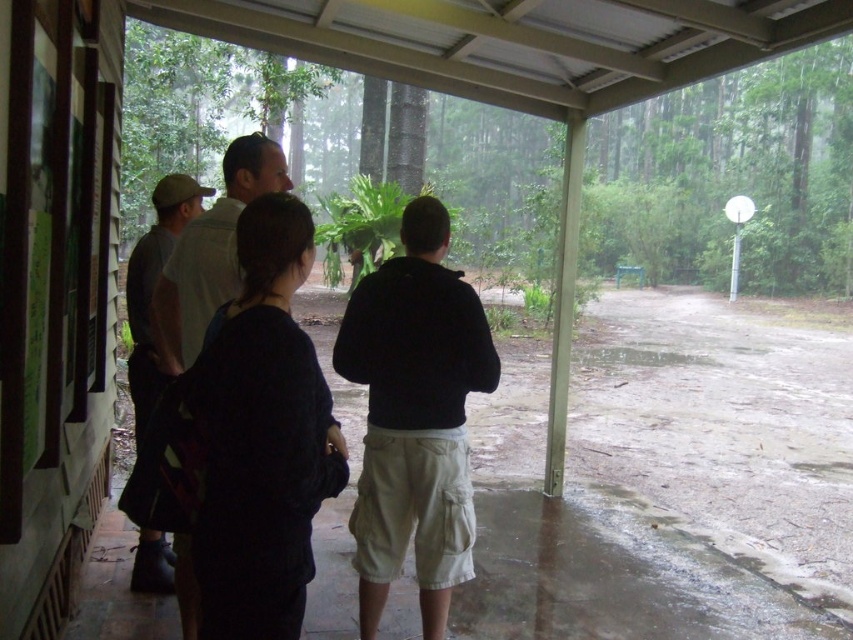
Question: Can you confirm if black cotton hoodie at center is bigger than dark gray shirt at center?

Choices:
 (A) yes
 (B) no

Answer: (A)

Question: Among these objects, which one is farthest from the camera?

Choices:
 (A) black cotton hoodie at center
 (B) dark gray shirt at center

Answer: (A)

Question: Is black cotton hoodie at center closer to camera compared to dark gray shirt at center?

Choices:
 (A) yes
 (B) no

Answer: (B)

Question: Can you confirm if black cotton hoodie at center is thinner than dark gray shirt at center?

Choices:
 (A) no
 (B) yes

Answer: (B)

Question: Which point is farther to the camera?

Choices:
 (A) dark gray shirt at center
 (B) black cotton hoodie at center

Answer: (B)